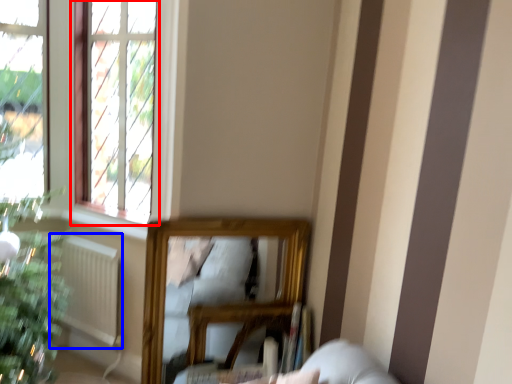
Question: Among these objects, which one is nearest to the camera, window (highlighted by a red box) or radiator (highlighted by a blue box)?

Choices:
 (A) window
 (B) radiator

Answer: (A)